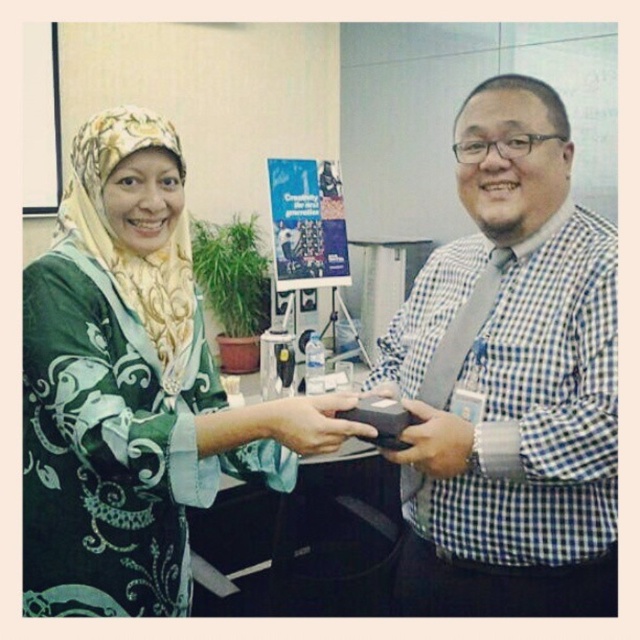
Consider the image. Is green printed dress at center wider than matte black box at center?

Correct, the width of green printed dress at center exceeds that of matte black box at center.

In the scene shown: Can you confirm if green printed dress at center is positioned above matte black box at center?

Yes.

The height and width of the screenshot is (640, 640). I want to click on green printed dress at center, so pos(124,387).

Between blue checkered shirt at center and matte black box at center, which one appears on the right side from the viewer's perspective?

From the viewer's perspective, blue checkered shirt at center appears more on the right side.

Who is higher up, blue checkered shirt at center or matte black box at center?

Positioned higher is blue checkered shirt at center.

Locate an element on the screen. The width and height of the screenshot is (640, 640). blue checkered shirt at center is located at coordinates (509, 380).

Identify the location of blue checkered shirt at center. The height and width of the screenshot is (640, 640). (509, 380).

Between matte black wallet at center and matte black box at center, which one is positioned higher?

matte black wallet at center

From the picture: Is the position of matte black wallet at center less distant than that of matte black box at center?

No, matte black wallet at center is behind matte black box at center.

The height and width of the screenshot is (640, 640). What do you see at coordinates (310, 422) in the screenshot?
I see `matte black wallet at center` at bounding box center [310, 422].

At what (x,y) coordinates should I click in order to perform the action: click on matte black wallet at center. Please return your answer as a coordinate pair (x, y). This screenshot has width=640, height=640. Looking at the image, I should click on (310, 422).